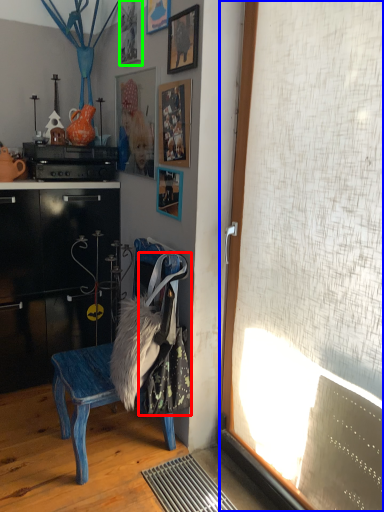
Question: Based on their relative distances, which object is nearer to laundry (highlighted by a red box)? Choose from window screen (highlighted by a blue box) and picture frame (highlighted by a green box).

Choices:
 (A) window screen
 (B) picture frame

Answer: (A)